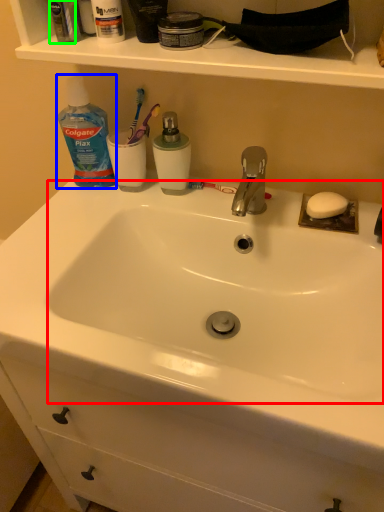
Question: Which object is positioned closest to sink (highlighted by a red box)? Select from cleaning product (highlighted by a blue box) and mouthwash (highlighted by a green box).

Choices:
 (A) cleaning product
 (B) mouthwash

Answer: (A)